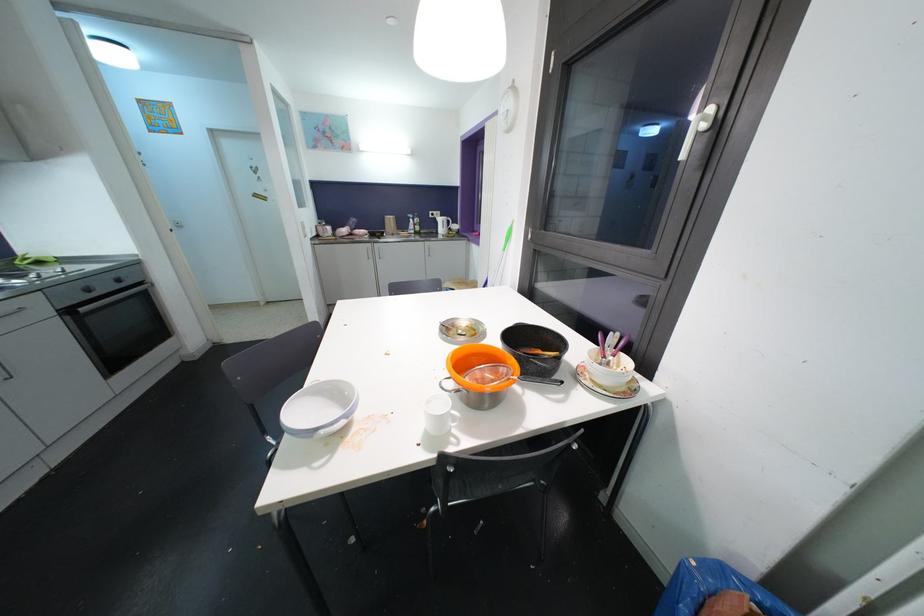
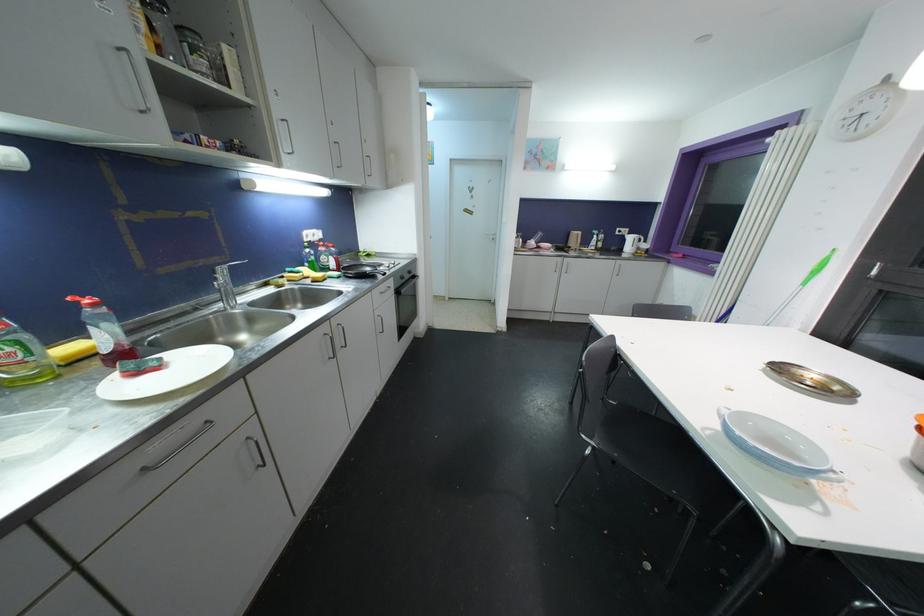
Question: The images are taken continuously from a first-person perspective. In which direction are you moving?

Choices:
 (A) Left
 (B) Right
 (C) Forward
 (D) Backward

Answer: (A)